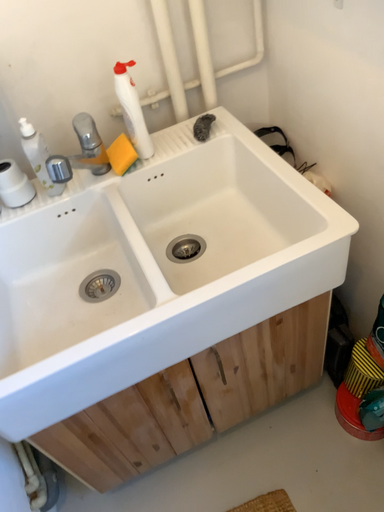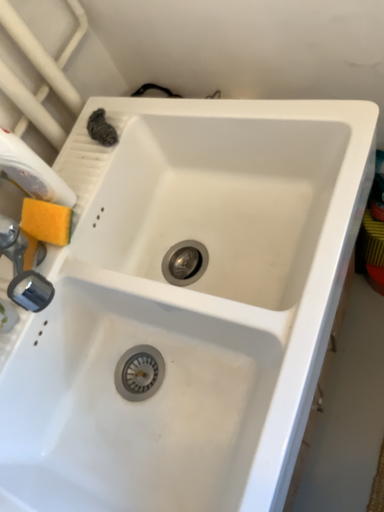
Question: Which way did the camera rotate in the video?

Choices:
 (A) rotated right
 (B) rotated left

Answer: (A)